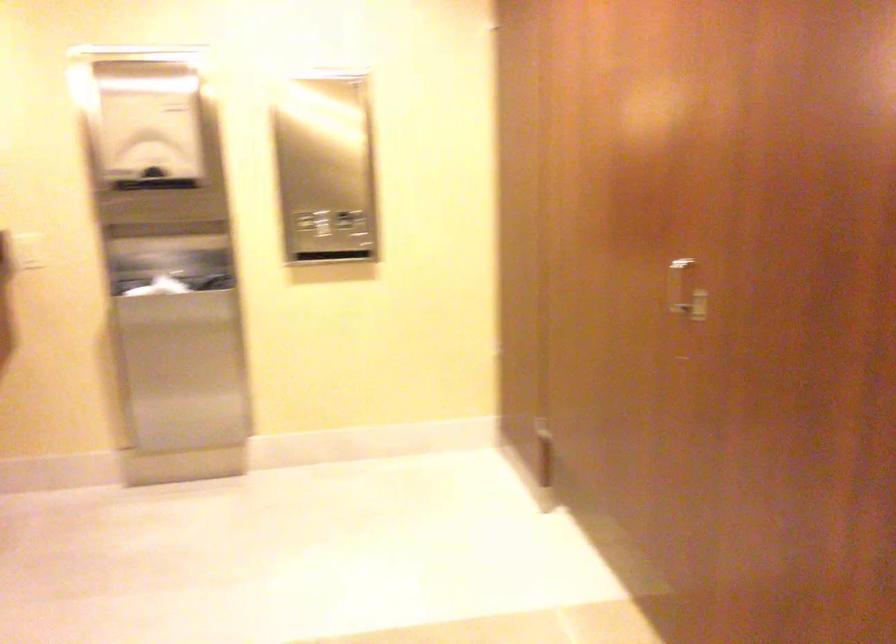
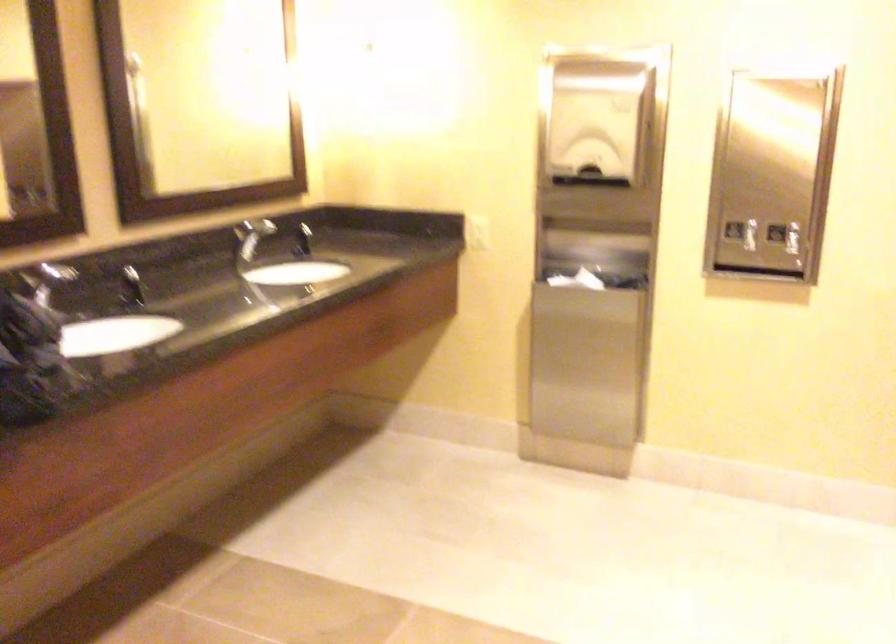
Question: How did the camera likely rotate?

Choices:
 (A) Left
 (B) Right
 (C) Up
 (D) Down

Answer: (A)